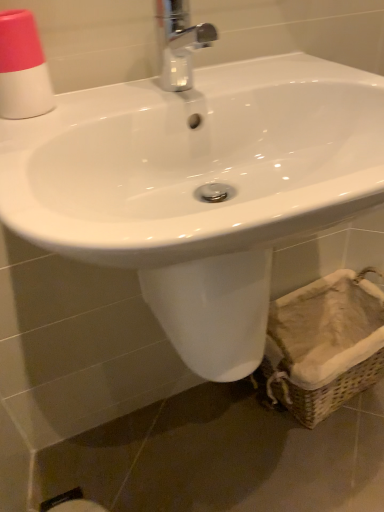
Where is `free point to the left of chrome metallic faucet at upper center`? The width and height of the screenshot is (384, 512). free point to the left of chrome metallic faucet at upper center is located at coordinates (102, 109).